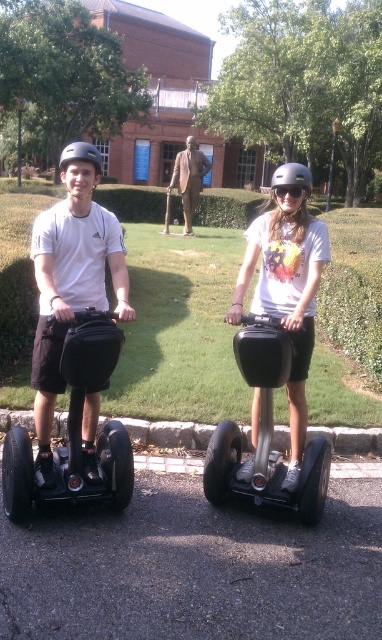
Question: From the image, what is the correct spatial relationship of matte white helmet at center in relation to matte black helmet at left?

Choices:
 (A) right
 (B) left

Answer: (A)

Question: Which point appears closest to the camera in this image?

Choices:
 (A) (304, 192)
 (B) (292, 328)
 (C) (95, 157)

Answer: (C)

Question: In this image, where is brown polished wood statue at center located relative to transparent yellow goggles at center?

Choices:
 (A) left
 (B) right

Answer: (A)

Question: Which point is farther to the camera?

Choices:
 (A) (291, 177)
 (B) (92, 148)

Answer: (A)

Question: Which object is closer to the camera taking this photo?

Choices:
 (A) matte black helmet at center
 (B) black matte segway at left

Answer: (B)

Question: Does black matte scooter at center appear on the left side of brown polished wood statue at center?

Choices:
 (A) yes
 (B) no

Answer: (B)